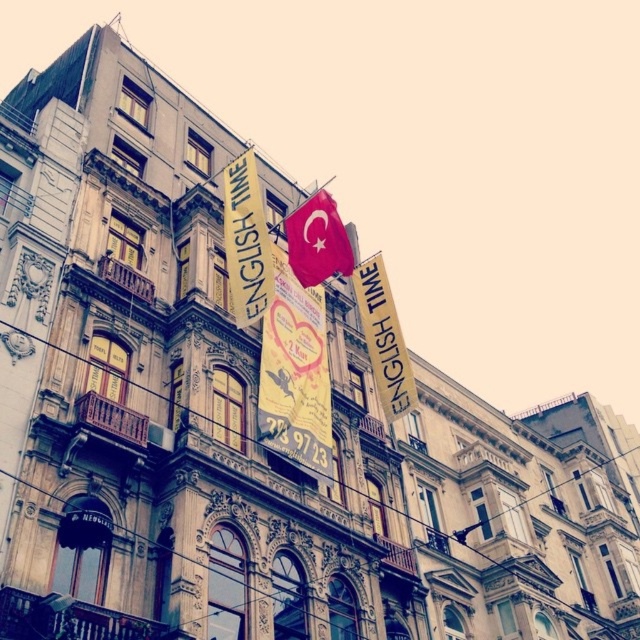
Consider the image. Does yellow fabric sign at upper center lie in front of yellow paper banner at upper center?

Yes, it is.

Does yellow fabric sign at upper center appear on the left side of yellow paper banner at upper center?

Correct, you'll find yellow fabric sign at upper center to the left of yellow paper banner at upper center.

What do you see at coordinates (246, 241) in the screenshot? This screenshot has height=640, width=640. I see `yellow fabric sign at upper center` at bounding box center [246, 241].

At what (x,y) coordinates should I click in order to perform the action: click on yellow fabric sign at upper center. Please return your answer as a coordinate pair (x, y). The height and width of the screenshot is (640, 640). Looking at the image, I should click on (246, 241).

Is yellow fabric sign at upper center taller than red fabric flag at center?

Yes, yellow fabric sign at upper center is taller than red fabric flag at center.

Between point (228, 227) and point (321, 237), which one is positioned in front?

Point (228, 227)

Is point (234, 275) closer to viewer compared to point (285, 234)?

That is True.

Locate an element on the screen. The height and width of the screenshot is (640, 640). yellow fabric sign at upper center is located at coordinates (246, 241).

Does yellow paper banner at upper center appear over red fabric flag at center?

Incorrect, yellow paper banner at upper center is not positioned above red fabric flag at center.

Is point (408, 358) farther from camera compared to point (324, 262)?

Yes, point (408, 358) is farther from viewer.

What are the coordinates of `yellow paper banner at upper center` in the screenshot? It's located at (384, 339).